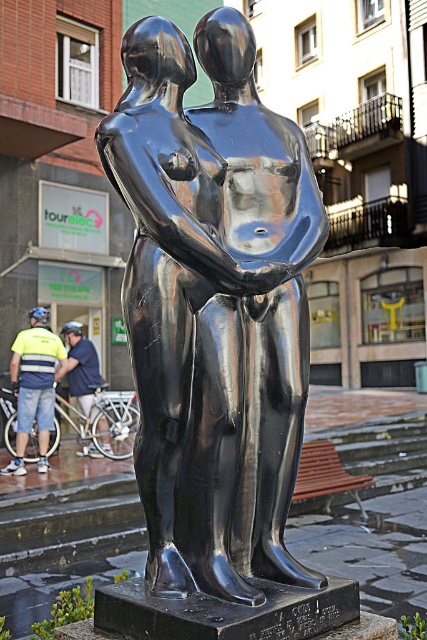
You are an art student analyzing the sculpture. You notice the polished black statue at center and the matte blue helmet at left. Which object is located to the right of the other?

The polished black statue at center is positioned on the right side of matte blue helmet at left.